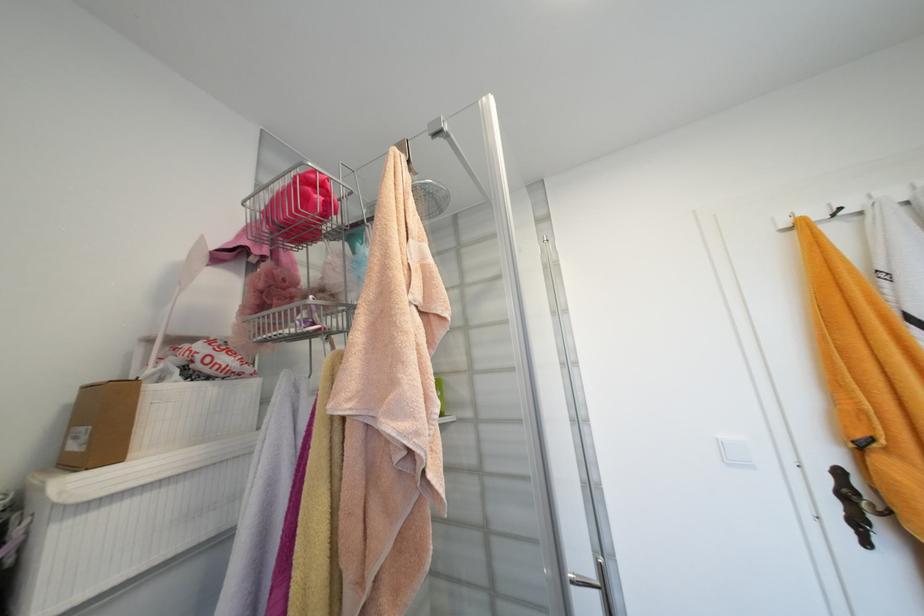
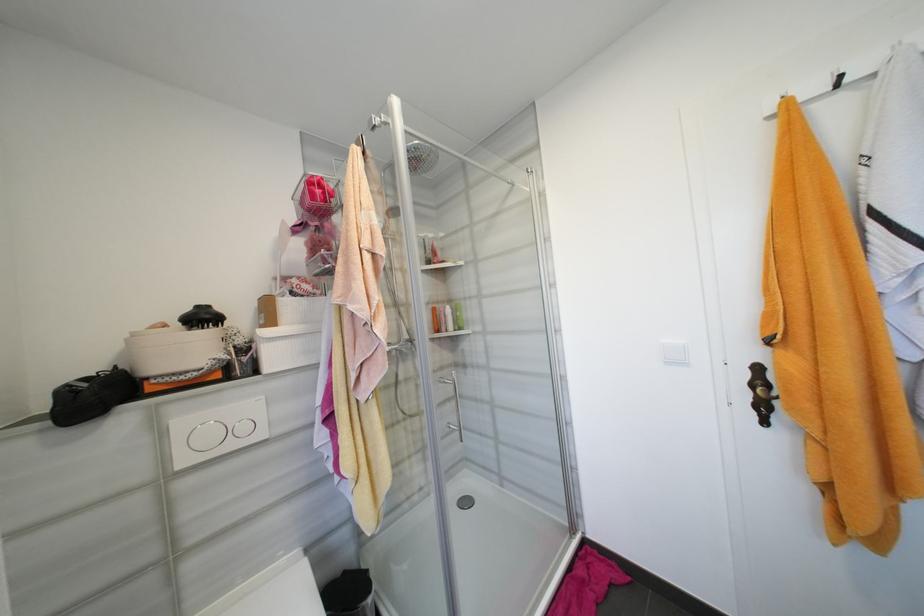
In a continuous first-person perspective shot, in which direction is the camera moving?

The cameraman moved toward right, backward.